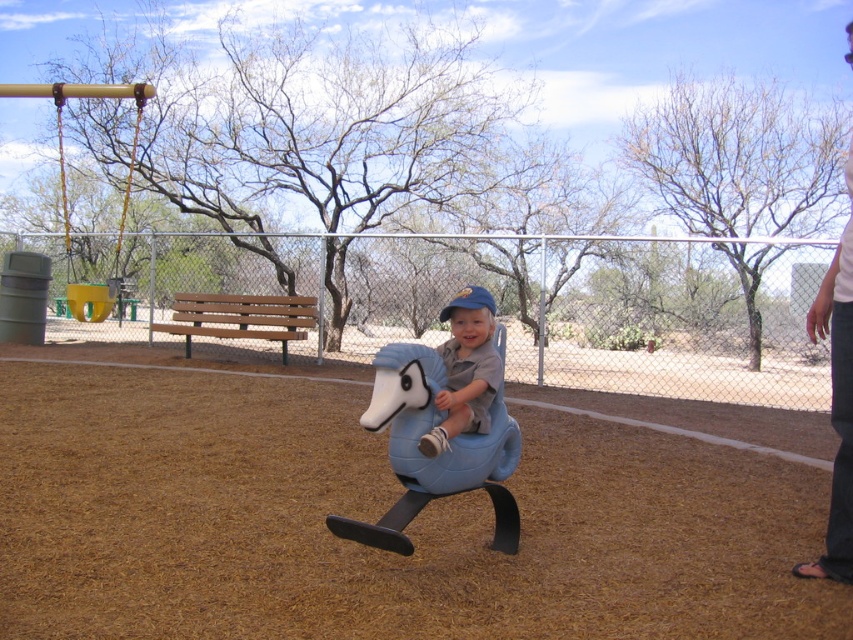
You are a parent supervising children at the playground. You see the matte blue plush horse at center and the yellow plastic swing at upper left. Which object is closer to you?

The matte blue plush horse at center is closer to you because it is in front of the yellow plastic swing at upper left.

You are a parent trying to decide between placing a small toy box between the matte blue plush horse at center and the yellow plastic swing at upper left. The toy box is 1 meter wide. Can the space between them accommodate it?

The matte blue plush horse at center has a lesser width compared to yellow plastic swing at upper left. Since the toy box is 1 meter wide, the space between them may be sufficient if the distance between the two objects is at least 1 meter. However, without knowing the exact distance, it is difficult to confirm. Please measure the space before placing the toy box.

You are a parent trying to decide where to place a new toy box in the playground. The toy box needs to be placed between the blue matte plastic horse at center and the white cotton shirt at upper right. Given their sizes, which object should the toy box be closer to?

The blue matte plastic horse at center is smaller than the white cotton shirt at upper right, so the toy box should be placed closer to the blue matte plastic horse at center to ensure there is enough space for both objects.